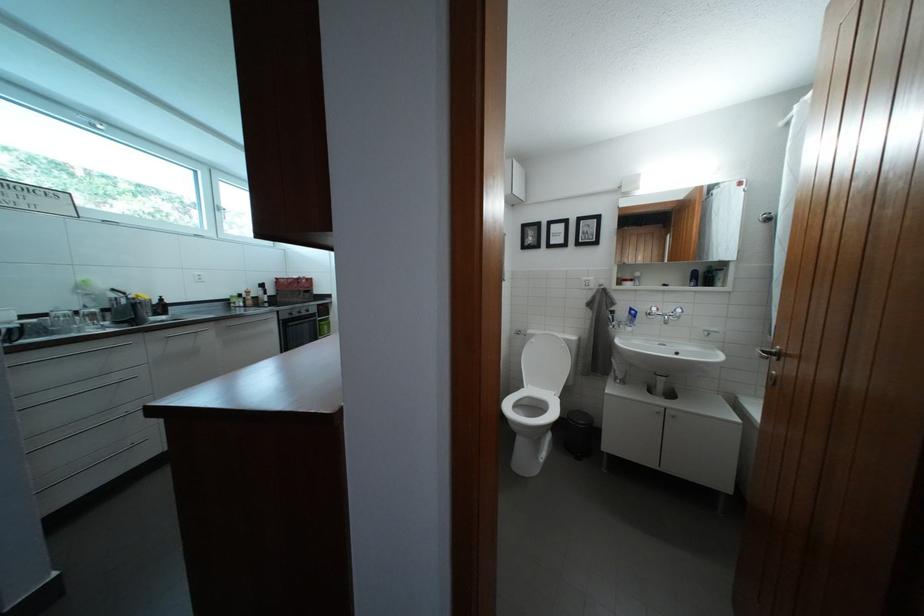
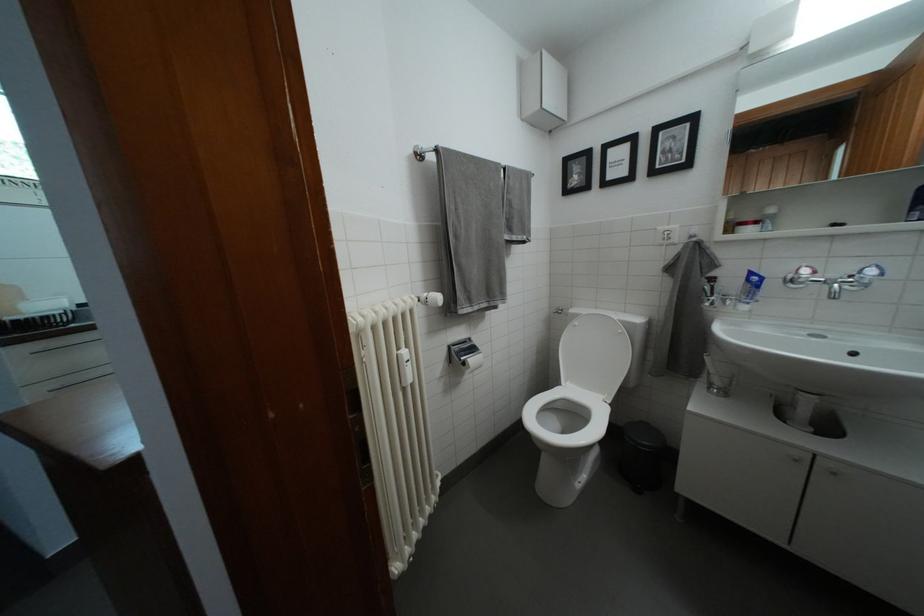
In the second image, find the point that corresponds to pixel 541 341 in the first image.

(585, 321)